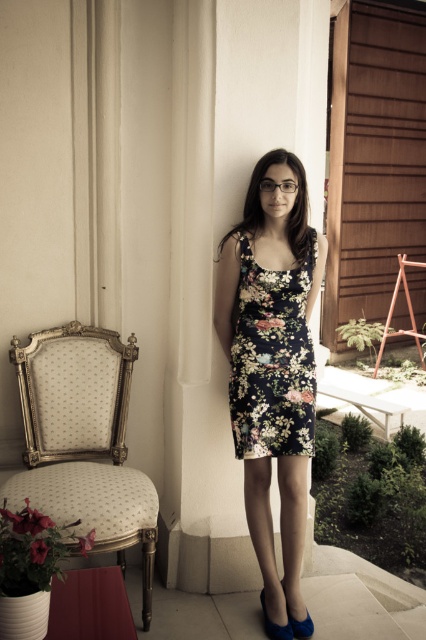
Question: Is floral fabric dress at center to the right of blue suede shoe at lower center from the viewer's perspective?

Choices:
 (A) yes
 (B) no

Answer: (B)

Question: Does gold-patterned armchair at left lie in front of blue suede shoe at lower center?

Choices:
 (A) yes
 (B) no

Answer: (A)

Question: Which point is closer to the camera taking this photo?

Choices:
 (A) (302, 636)
 (B) (106, 339)

Answer: (A)

Question: Among these objects, which one is nearest to the camera?

Choices:
 (A) gold-patterned armchair at left
 (B) floral-patterned fabric dress at center
 (C) floral fabric dress at center

Answer: (A)

Question: Among these objects, which one is nearest to the camera?

Choices:
 (A) gold-patterned armchair at left
 (B) floral-patterned fabric dress at center

Answer: (A)

Question: Is floral-patterned fabric dress at center to the left of blue suede shoe at lower center from the viewer's perspective?

Choices:
 (A) no
 (B) yes

Answer: (B)